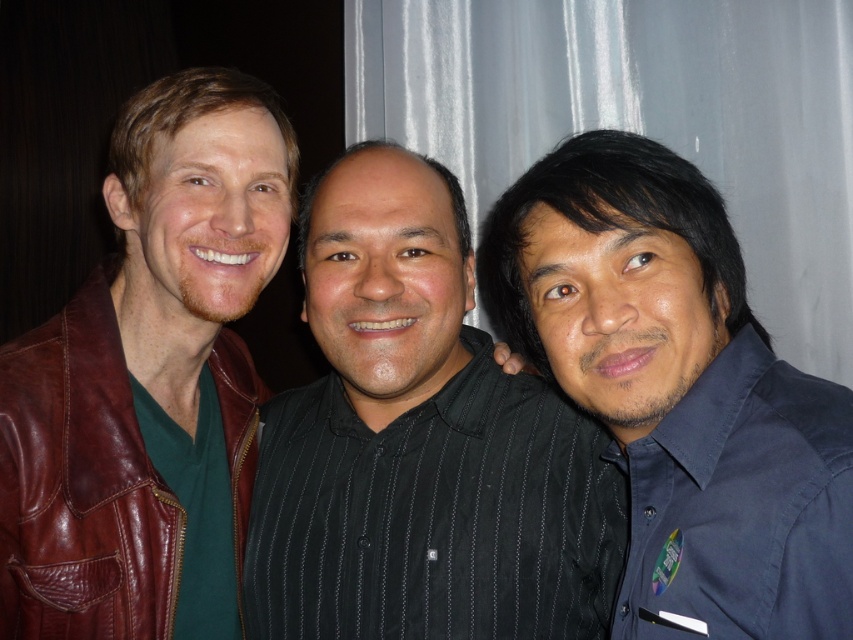
Based on the scene description, can you determine the spatial relationship between the black striped shirt at center and the brown leather jacket at left?

The black striped shirt at center is to the right of the brown leather jacket at left.

You are organizing a clothing donation drive and need to categorize the items based on their size. You have a black striped shirt at center and a brown leather jacket at left. Which item should be placed in the larger size bin?

The black striped shirt at center should be placed in the larger size bin because its width is greater than that of the brown leather jacket at left.

You are at a party and need to find the person wearing the dark blue shirt at right. Can you tell me where it is relative to the brown leather jacket at left?

The dark blue shirt at right is located above the brown leather jacket at left.